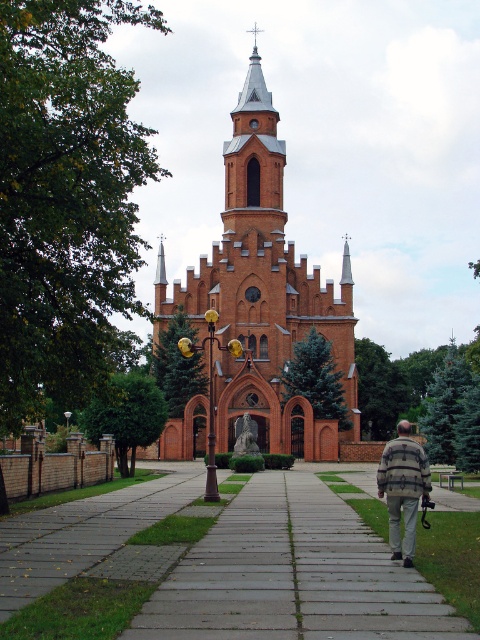
You are a photographer standing in front of the brick church at center and the striped fabric jacket at center. You want to take a photo that includes both objects. Which object should you move closer to in order to include both in the frame without zooming in?

The brick church at center is larger than the striped fabric jacket at center. To include both in the frame without zooming in, you should move closer to the brick church at center so that it takes up less space in the photo, allowing the striped fabric jacket at center to also fit into the frame.